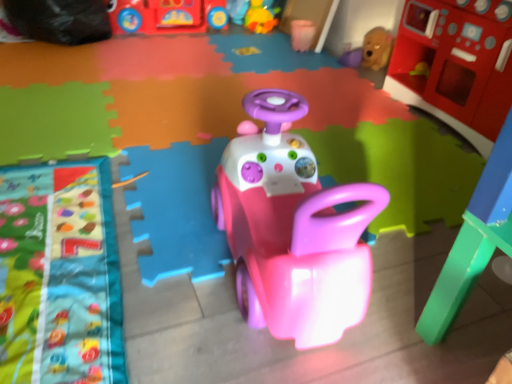
Question: Is rubberized red play kitchen at upper right, marked as the sixth toy in a left-to-right arrangement, turned away from pink plastic car at center, the fourth toy viewed from the right?

Choices:
 (A) yes
 (B) no

Answer: (B)

Question: Could you tell me if rubberized red play kitchen at upper right, marked as the sixth toy in a left-to-right arrangement, is facing pink plastic car at center, the fourth toy viewed from the right?

Choices:
 (A) no
 (B) yes

Answer: (B)

Question: Can you confirm if rubberized red play kitchen at upper right, marked as the sixth toy in a left-to-right arrangement, is smaller than pink plastic car at center, positioned as the third toy in left-to-right order?

Choices:
 (A) yes
 (B) no

Answer: (B)

Question: Is rubberized red play kitchen at upper right, marked as the sixth toy in a left-to-right arrangement, at the right side of pink plastic car at center, positioned as the third toy in left-to-right order?

Choices:
 (A) no
 (B) yes

Answer: (B)

Question: Are rubberized red play kitchen at upper right, marked as the sixth toy in a left-to-right arrangement, and pink plastic car at center, the fourth toy viewed from the right, far apart?

Choices:
 (A) yes
 (B) no

Answer: (B)

Question: Looking at their shapes, would you say pink plastic car at center, the fourth toy viewed from the right, is wider or thinner than rubber duck at upper center, which appears as the second toy when viewed from the left?

Choices:
 (A) wide
 (B) thin

Answer: (B)

Question: Relative to rubber duck at upper center, the fifth toy positioned from the right, is pink plastic car at center, the fourth toy viewed from the right, in front or behind?

Choices:
 (A) behind
 (B) front

Answer: (B)

Question: From a real-world perspective, is pink plastic car at center, the fourth toy viewed from the right, positioned above or below rubber duck at upper center, the fifth toy positioned from the right?

Choices:
 (A) above
 (B) below

Answer: (A)

Question: Choose the correct answer: Is pink plastic car at center, the fourth toy viewed from the right, inside rubber duck at upper center, which appears as the second toy when viewed from the left, or outside it?

Choices:
 (A) inside
 (B) outside

Answer: (B)

Question: Would you say shiny plastic bus at upper center, which is counted as the sixth toy, starting from the right, is to the left or to the right of rubberized red play kitchen at upper right, marked as the 1th toy in a right-to-left arrangement, in the picture?

Choices:
 (A) right
 (B) left

Answer: (B)

Question: Relative to rubberized red play kitchen at upper right, marked as the sixth toy in a left-to-right arrangement, is shiny plastic bus at upper center, marked as the 1th toy in a left-to-right arrangement, in front or behind?

Choices:
 (A) front
 (B) behind

Answer: (B)

Question: From their relative heights in the image, would you say shiny plastic bus at upper center, marked as the 1th toy in a left-to-right arrangement, is taller or shorter than rubberized red play kitchen at upper right, marked as the sixth toy in a left-to-right arrangement?

Choices:
 (A) tall
 (B) short

Answer: (B)

Question: Based on their sizes in the image, would you say shiny plastic bus at upper center, which is counted as the sixth toy, starting from the right, is bigger or smaller than rubberized red play kitchen at upper right, marked as the 1th toy in a right-to-left arrangement?

Choices:
 (A) big
 (B) small

Answer: (B)

Question: Based on their positions, is pink plastic cup at upper center, which ranks as the 3th toy in right-to-left order, located to the left or right of pink plastic car at center, positioned as the third toy in left-to-right order?

Choices:
 (A) right
 (B) left

Answer: (A)

Question: Choose the correct answer: Is pink plastic cup at upper center, acting as the 4th toy starting from the left, inside pink plastic car at center, the fourth toy viewed from the right, or outside it?

Choices:
 (A) inside
 (B) outside

Answer: (B)